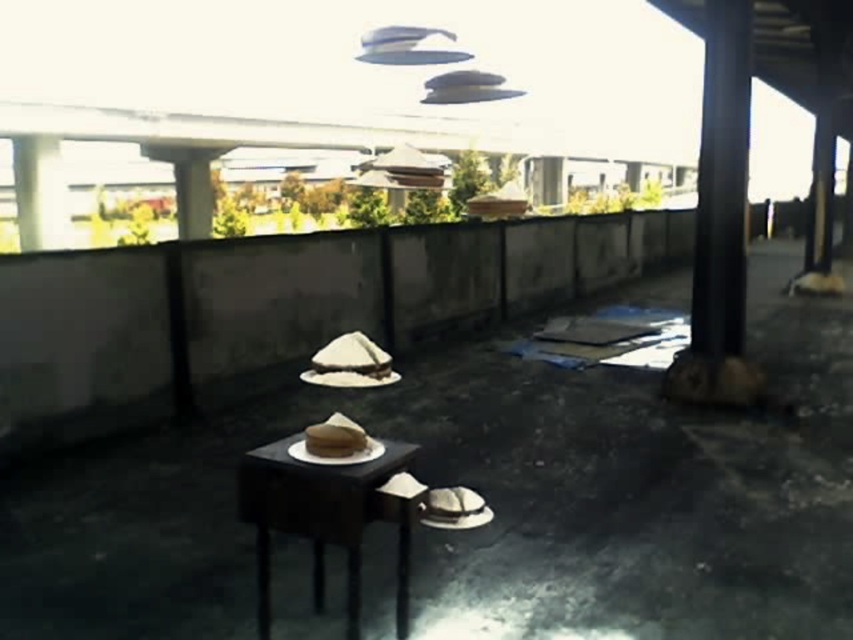
You are an event planner setting up for a rooftop event. You have a matte black table at center and a brown matte cowboy hat at lower center. Where should you place the hat so it doesn not obstruct the view of the table from the entrance?

The brown matte cowboy hat at lower center should be placed above the matte black table at center since the matte black table at center is positioned under brown matte cowboy hat at lower center, ensuring the table remains visible from the entrance.

You are standing at the edge of the rooftop and want to place a new decorative item between the matte black table at center and the brown matte cowboy hat at lower center. Based on their positions, which object should you place it closer to?

The matte black table at center is to the left of the brown matte cowboy hat at lower center, so placing the new item closer to the matte black table at center would position it between them.

You are standing at the edge of the rooftop and looking towards the center. There is a point marked at coordinates (326,516). What object is located at that point?

The point at coordinates (326,516) corresponds to the matte black table at center.